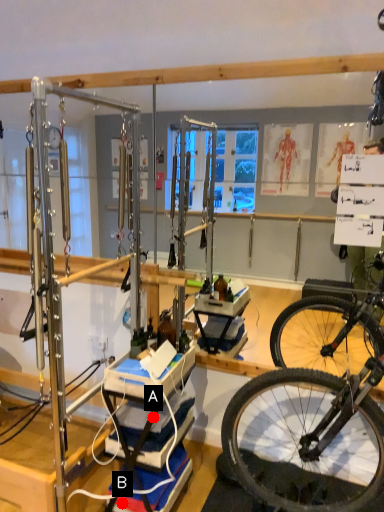
Question: Two points are circled on the image, labeled by A and B beside each circle. Which point is farther to the camera?

Choices:
 (A) A is further
 (B) B is further

Answer: (A)